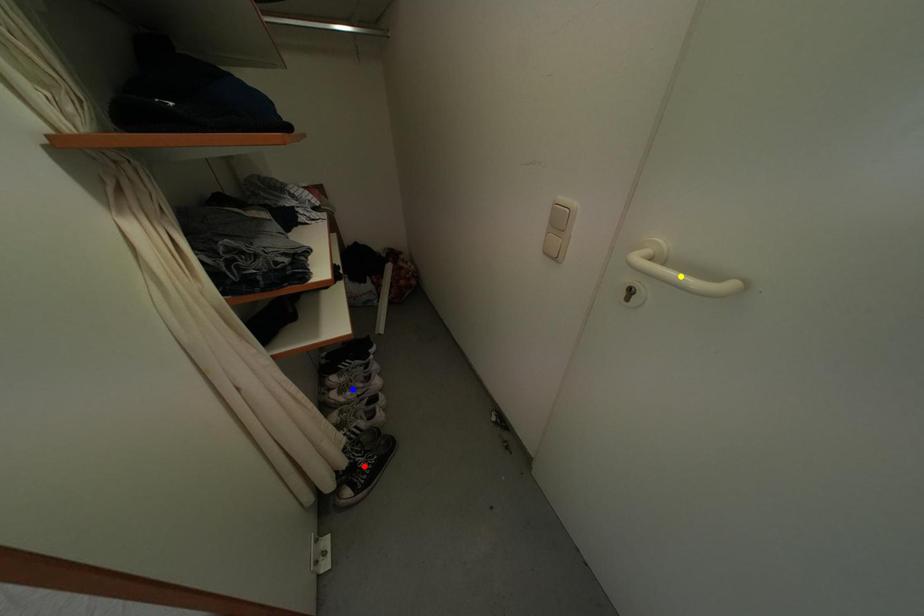
Order these from nearest to farthest:
A) red point
B) blue point
C) yellow point

yellow point → red point → blue point